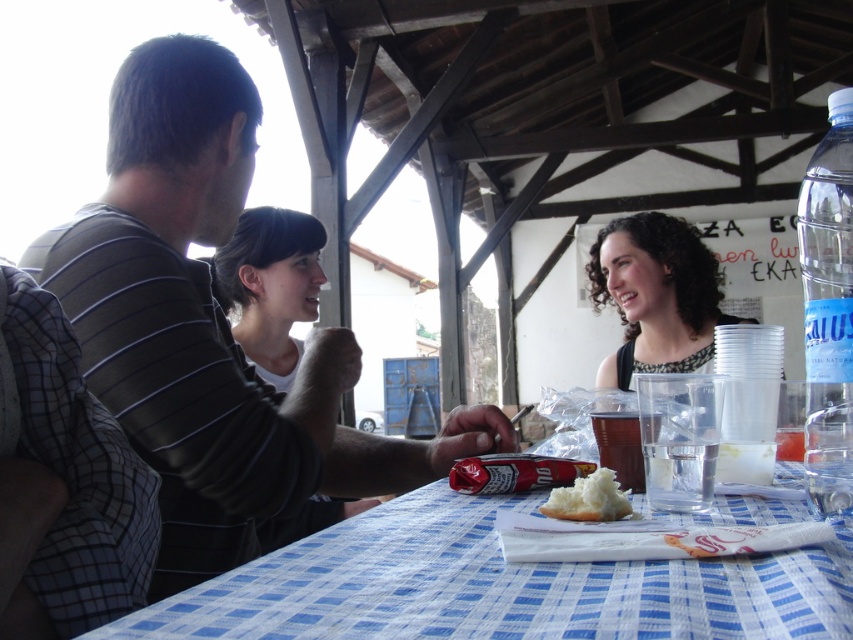
From the picture: You are a waiter at the outdoor dining area under the wooden pergola. You need to deliver a dessert to the customer with matte black hair at center. Where should you place the dessert relative to the blue checkered tablecloth at center?

The blue checkered tablecloth at center is positioned on the right side of matte black hair at center, so you should place the dessert to the left side of the blue checkered tablecloth at center to reach the customer with matte black hair at center.

You are a waiter at the outdoor dining area under the wooden pergola. You need to place a new drink order on the table. Which object, the blue checkered tablecloth at center or the translucent plastic cup at table center, should you avoid placing the drink directly on top of to prevent it from tipping over?

The translucent plastic cup at table center is taller than the blue checkered tablecloth at center, so placing the drink on the translucent plastic cup at table center might cause instability. Therefore, you should avoid placing the drink directly on the translucent plastic cup at table center to prevent it from tipping over.